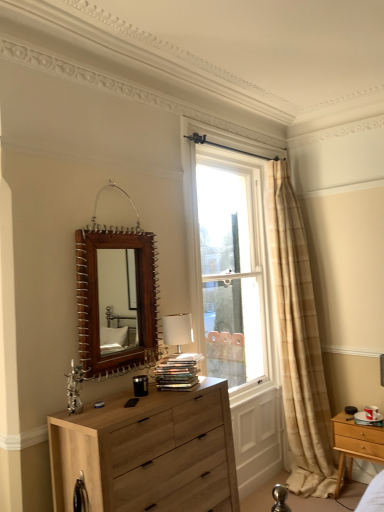
This screenshot has width=384, height=512. In order to click on vacant area on top of light wood/texture nightstand at lower right (from a real-world perspective) in this screenshot , I will do `click(367, 418)`.